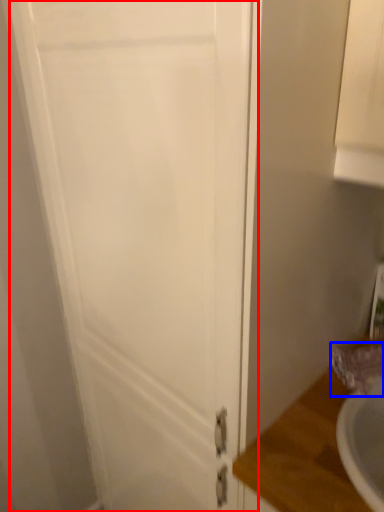
Question: Which of the following is the closest to the observer, door (highlighted by a red box) or faucet (highlighted by a blue box)?

Choices:
 (A) door
 (B) faucet

Answer: (A)